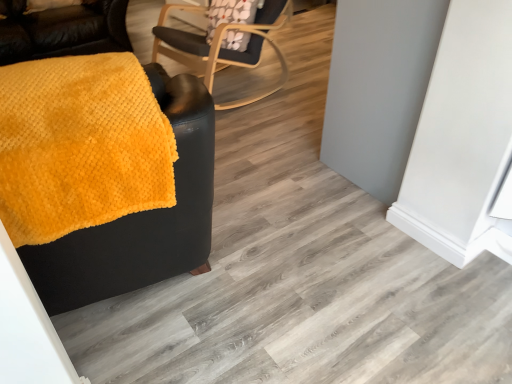
Identify the location of soft yellow knit blanket at left. The image size is (512, 384). coord(139,219).

The image size is (512, 384). Describe the element at coordinates (139, 219) in the screenshot. I see `soft yellow knit blanket at left` at that location.

I want to click on soft yellow knit blanket at left, so click(x=139, y=219).